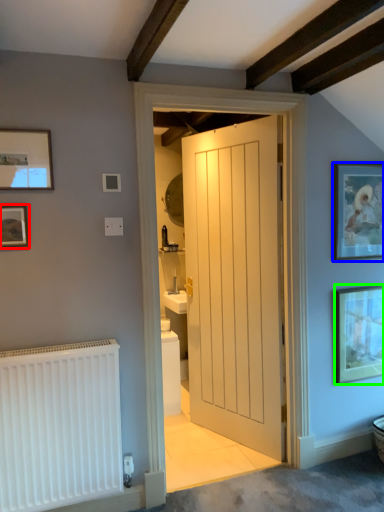
Question: Which object is the closest to the picture frame (highlighted by a red box)? Choose among these: picture frame (highlighted by a blue box) or picture frame (highlighted by a green box).

Choices:
 (A) picture frame
 (B) picture frame

Answer: (A)